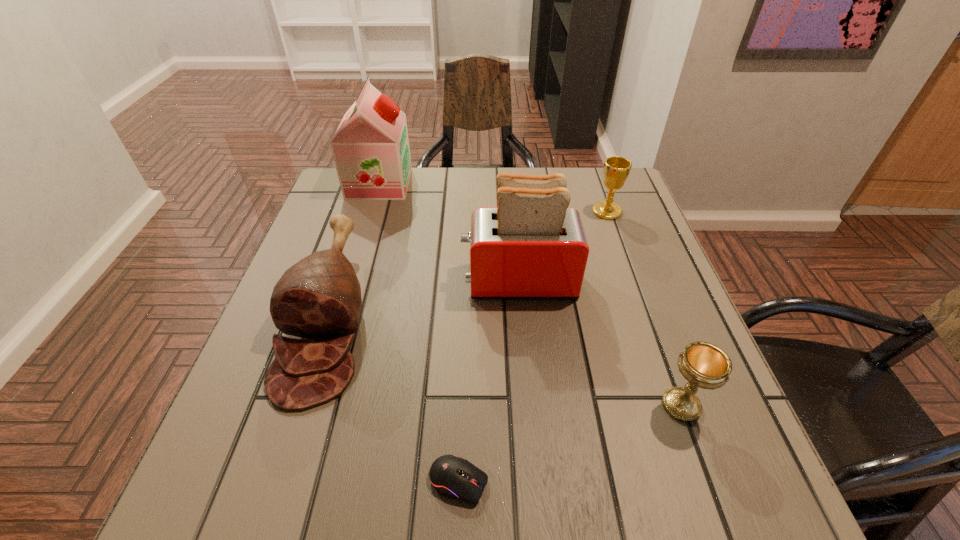
Where is `the farthest object`? the farthest object is located at coordinates pyautogui.click(x=370, y=147).

Identify the location of toaster. This screenshot has width=960, height=540. (532, 245).

The height and width of the screenshot is (540, 960). In order to click on ham in this screenshot , I will do `click(319, 297)`.

Identify the location of the fifth nearest object. (616, 169).

Where is `the nearer chalice`? the nearer chalice is located at coordinates (704, 365).

This screenshot has height=540, width=960. In order to click on the nearest object in this screenshot , I will do `click(453, 477)`.

This screenshot has width=960, height=540. I want to click on the shortest object, so click(453, 477).

Find the location of a particular element. This screenshot has width=960, height=540. vacant region located with the cap open on the soya milk is located at coordinates (525, 183).

Identify the location of free space located on the front-facing side of the toaster. (312, 281).

This screenshot has height=540, width=960. Identify the location of vacant position located on the front-facing side of the toaster. 316,281.